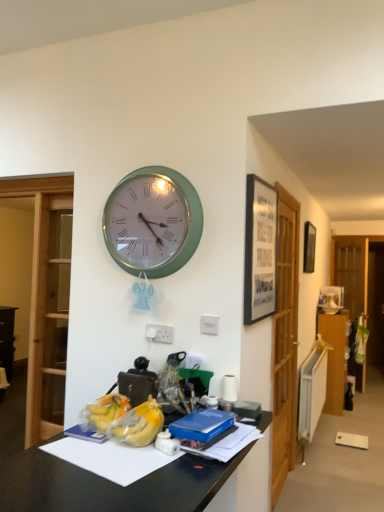
At what (x,y) coordinates should I click in order to perform the action: click on free spot to the left of translucent plastic bananas at center. Please return your answer as a coordinate pair (x, y). Looking at the image, I should click on (82, 449).